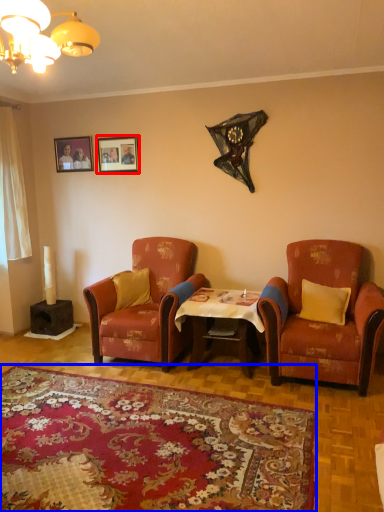
Question: Which point is closer to the camera, picture frame (highlighted by a red box) or plain (highlighted by a blue box)?

Choices:
 (A) picture frame
 (B) plain

Answer: (B)